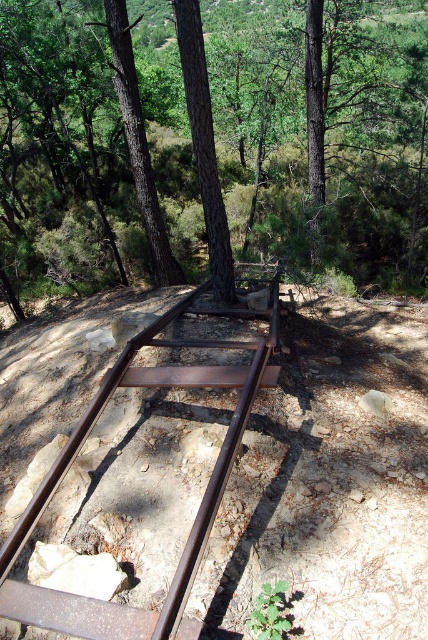
You are a hiker who wants to cross the forest area. You see the rusty metal train track at center and the brown textured wood at upper center. Which object takes up more space in the image?

The brown textured wood at upper center occupies more space than the rusty metal train track at center.

You are a park ranger planning to plant new trees in the abandoned railway area. You have a new sapling that needs at least 10 meters of space between it and the nearest tree. Based on the image, can you plant the sapling between the green leafy trees at upper center and the brown wood tree at center?

The distance between the green leafy trees at upper center and the brown wood tree at center is 12.18 meters, which is more than the required 10 meters. Therefore, you can plant the sapling between them as there is sufficient space.